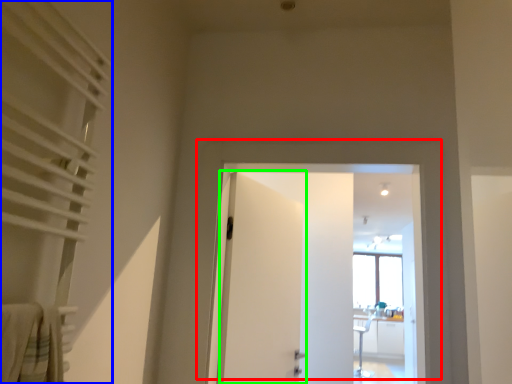
Question: Which object is positioned farthest from door (highlighted by a red box)? Select from curtain (highlighted by a blue box) and door (highlighted by a green box).

Choices:
 (A) curtain
 (B) door

Answer: (A)